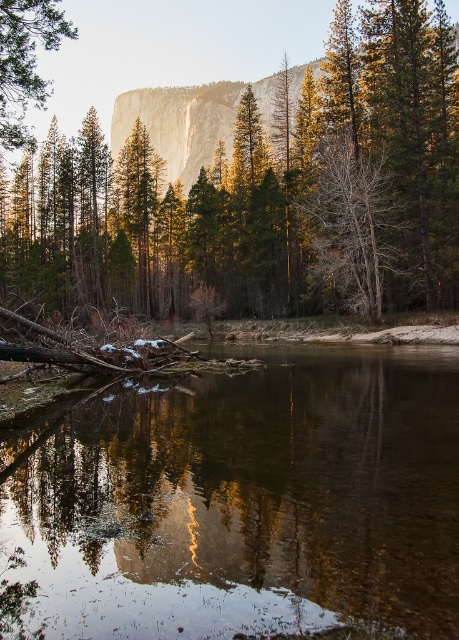
Question: Where is bare wood tree at center located in relation to green matte tree at upper left in the image?

Choices:
 (A) right
 (B) left

Answer: (A)

Question: Which of these objects is positioned farthest from the green matte trees at center?

Choices:
 (A) bare wood tree at center
 (B) green matte tree at upper left

Answer: (B)

Question: Which of the following is the closest to the observer?

Choices:
 (A) (16, 61)
 (B) (132, 602)
 (C) (301, 200)
 (D) (454, 257)

Answer: (B)

Question: Is clear water at center wider than green matte tree at upper left?

Choices:
 (A) no
 (B) yes

Answer: (B)

Question: Can you confirm if clear water at center is thinner than green matte tree at upper left?

Choices:
 (A) yes
 (B) no

Answer: (B)

Question: Which object is farther from the camera taking this photo?

Choices:
 (A) bare wood tree at center
 (B) green matte trees at center
 (C) green matte tree at upper left
 (D) clear water at center

Answer: (A)